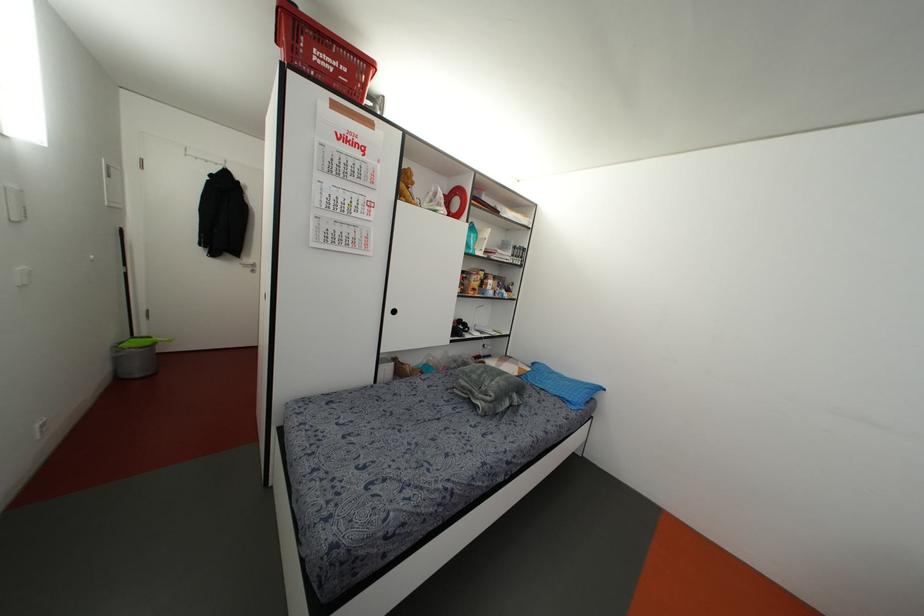
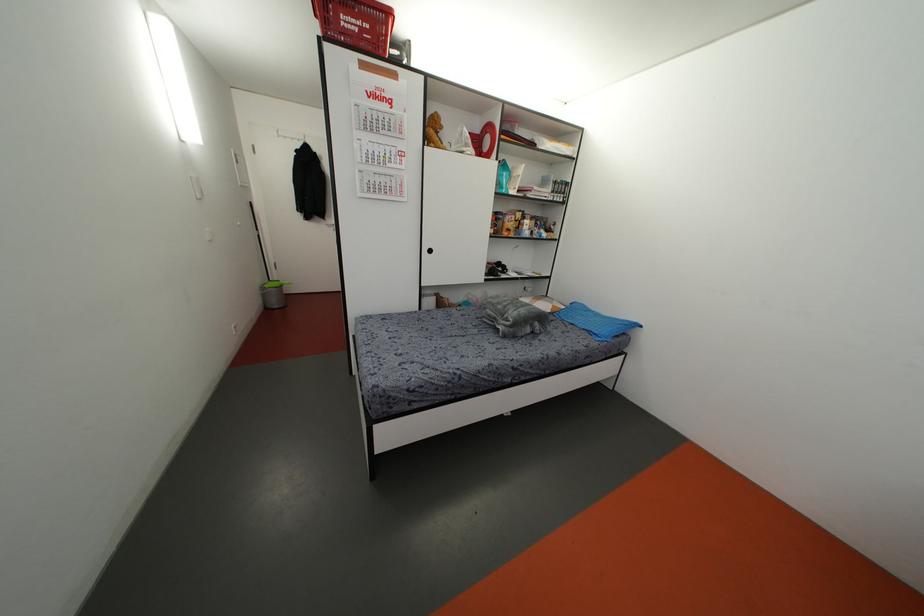
Find the pixel in the second image that matches (116,347) in the first image.

(261, 288)